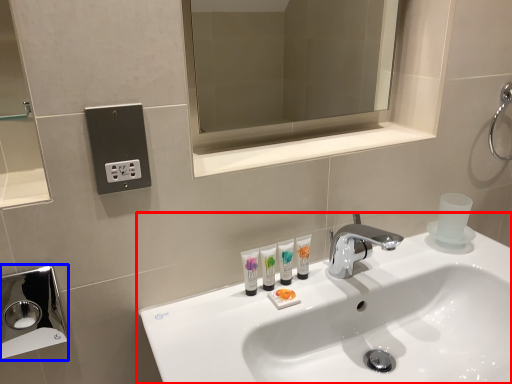
Question: Among these objects, which one is nearest to the camera, sink (highlighted by a red box) or hand dryer (highlighted by a blue box)?

Choices:
 (A) sink
 (B) hand dryer

Answer: (A)